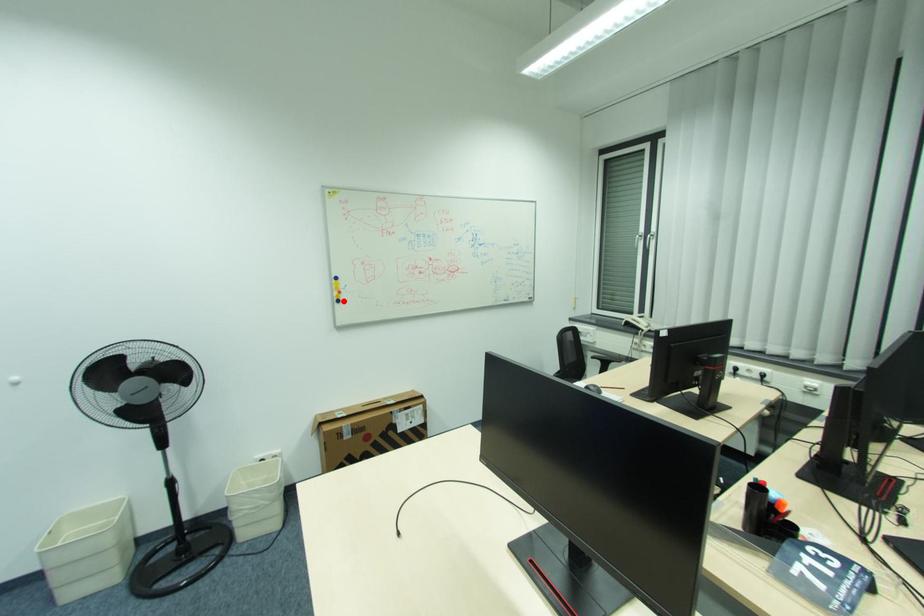
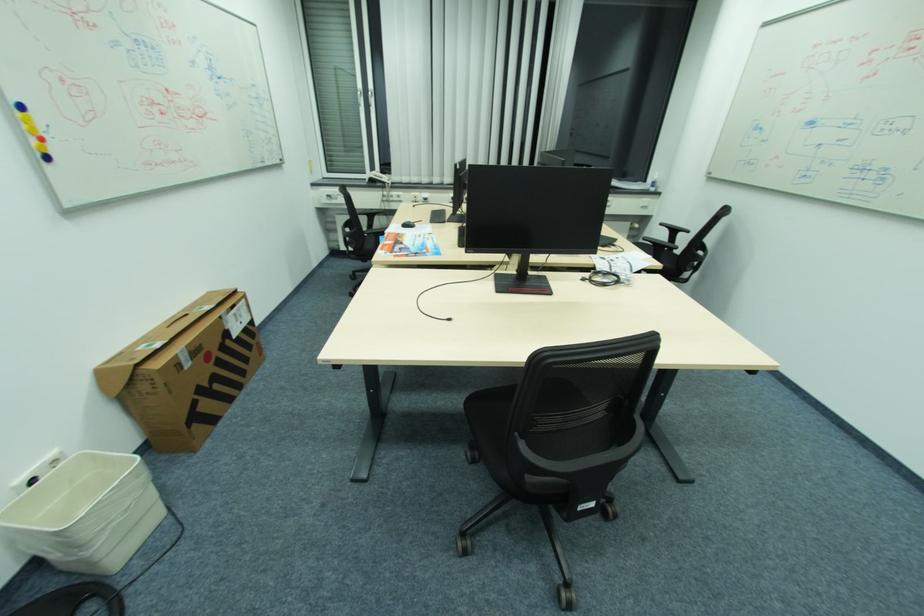
Locate, in the second image, the point that corresponds to the highlighted location in the first image.

(52, 158)